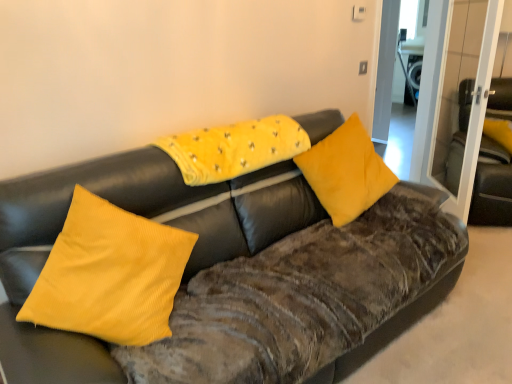
Question: Is the position of yellow corduroy pillow at left, acting as the 3th pillow starting from the right, more distant than that of transparent glass door at upper right?

Choices:
 (A) no
 (B) yes

Answer: (A)

Question: Is yellow corduroy pillow at left, acting as the 3th pillow starting from the right, to the left of transparent glass door at upper right from the viewer's perspective?

Choices:
 (A) no
 (B) yes

Answer: (B)

Question: Is yellow corduroy pillow at left, marked as the 1th pillow in a left-to-right arrangement, completely or partially outside of transparent glass door at upper right?

Choices:
 (A) no
 (B) yes

Answer: (B)

Question: From a real-world perspective, is yellow corduroy pillow at left, acting as the 3th pillow starting from the right, physically below transparent glass door at upper right?

Choices:
 (A) no
 (B) yes

Answer: (B)

Question: Does yellow corduroy pillow at left, acting as the 3th pillow starting from the right, have a lesser height compared to transparent glass door at upper right?

Choices:
 (A) yes
 (B) no

Answer: (A)

Question: Would you say yellow corduroy pillow at left, marked as the 1th pillow in a left-to-right arrangement, contains transparent glass door at upper right?

Choices:
 (A) no
 (B) yes

Answer: (A)

Question: Is velvet black armchair at right touching yellow corduroy pillow at left, marked as the 1th pillow in a left-to-right arrangement?

Choices:
 (A) no
 (B) yes

Answer: (A)

Question: Does velvet black armchair at right have a larger size compared to yellow corduroy pillow at left, acting as the 3th pillow starting from the right?

Choices:
 (A) no
 (B) yes

Answer: (B)

Question: From a real-world perspective, is velvet black armchair at right below yellow corduroy pillow at left, marked as the 1th pillow in a left-to-right arrangement?

Choices:
 (A) no
 (B) yes

Answer: (B)

Question: Is velvet black armchair at right at the right side of yellow corduroy pillow at left, marked as the 1th pillow in a left-to-right arrangement?

Choices:
 (A) no
 (B) yes

Answer: (B)

Question: Does velvet black armchair at right lie in front of yellow corduroy pillow at left, marked as the 1th pillow in a left-to-right arrangement?

Choices:
 (A) no
 (B) yes

Answer: (A)

Question: Does velvet black armchair at right come behind yellow corduroy pillow at left, acting as the 3th pillow starting from the right?

Choices:
 (A) no
 (B) yes

Answer: (B)

Question: Does yellow corduroy pillow at center, which appears as the 3th pillow when viewed from the left, have a greater width compared to yellow corduroy pillow at left, marked as the 1th pillow in a left-to-right arrangement?

Choices:
 (A) no
 (B) yes

Answer: (A)